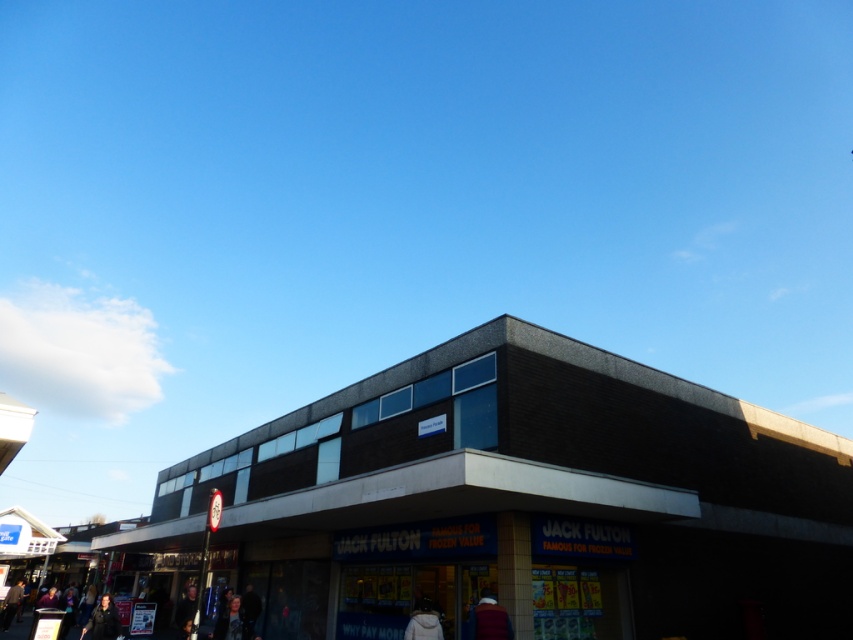
The image size is (853, 640). Describe the element at coordinates (518, 502) in the screenshot. I see `dark gray concrete jack fulton store at center` at that location.

Does dark gray concrete jack fulton store at center have a larger size compared to white fabric jacket at lower center?

Correct, dark gray concrete jack fulton store at center is larger in size than white fabric jacket at lower center.

Find the location of a particular element. dark gray concrete jack fulton store at center is located at coordinates (518, 502).

The image size is (853, 640). I want to click on dark gray concrete jack fulton store at center, so [x=518, y=502].

Is velvet-like burgundy coat at lower center below dark blue leather jacket at lower left?

No, velvet-like burgundy coat at lower center is not below dark blue leather jacket at lower left.

Does point (473, 618) come in front of point (91, 632)?

Yes, it is in front of point (91, 632).

Identify the location of velvet-like burgundy coat at lower center. The image size is (853, 640). (488, 618).

Can you confirm if velvet-like burgundy coat at lower center is positioned below white fabric jacket at lower center?

No.

From the picture: Who is more distant from viewer, (486, 604) or (438, 627)?

Point (438, 627)

The width and height of the screenshot is (853, 640). Identify the location of velvet-like burgundy coat at lower center. pos(488,618).

The height and width of the screenshot is (640, 853). What are the coordinates of `velvet-like burgundy coat at lower center` in the screenshot? It's located at (488, 618).